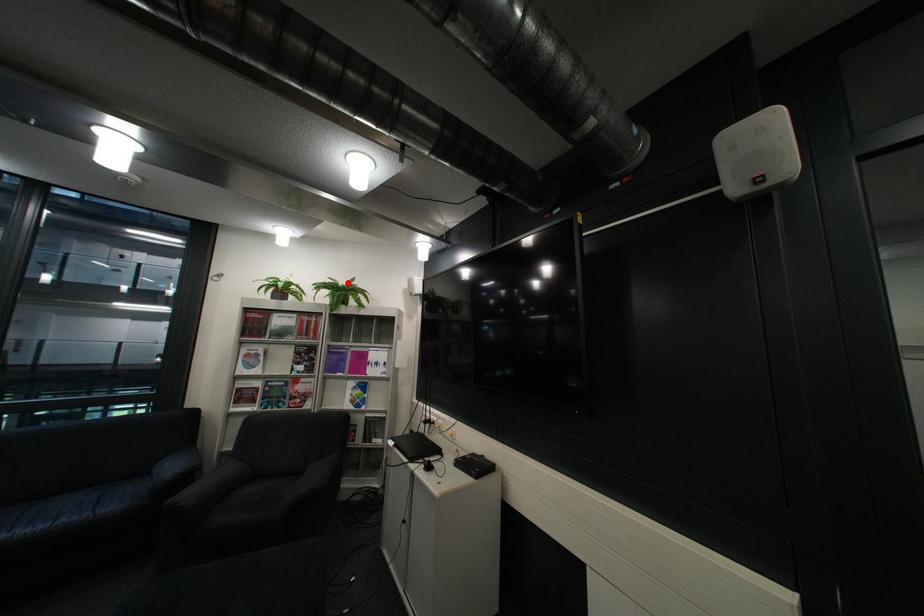
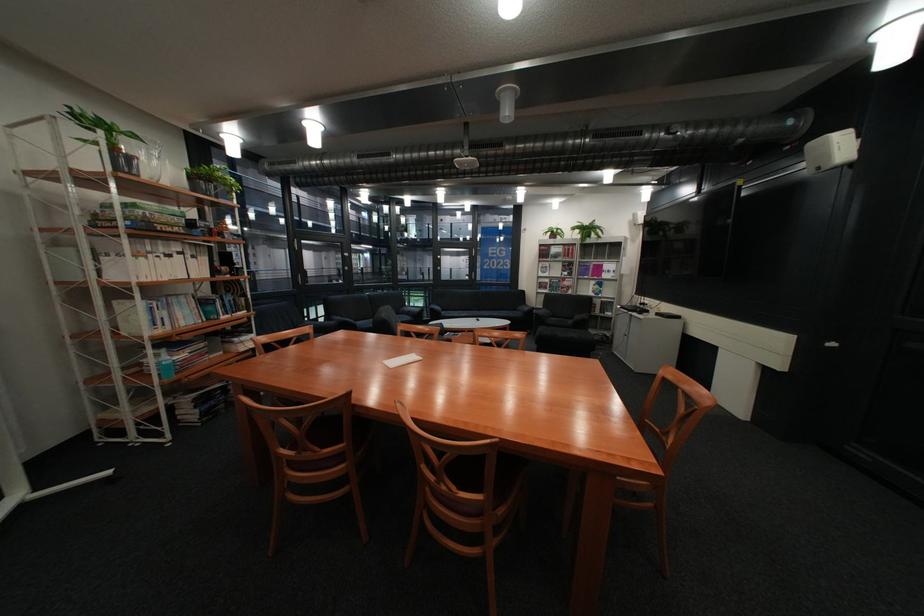
Question: I am providing you with two images of the same scene from different viewpoints. Image1 has a red point marked. In image2, the corresponding 3D location appears at what relative position? Reply with the corresponding letter.

Choices:
 (A) Closer
 (B) Farther

Answer: (A)